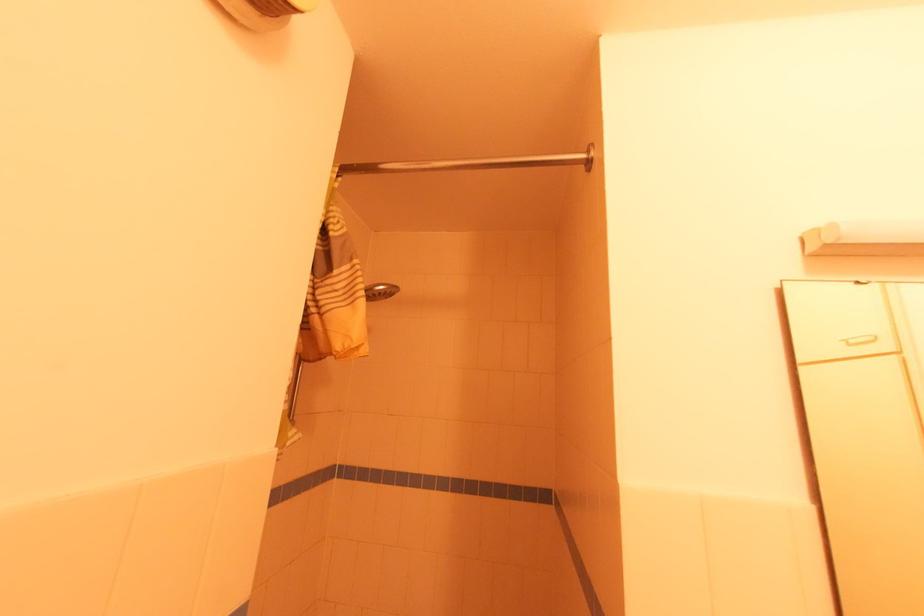
The image size is (924, 616). I want to click on cabinet door handle, so click(x=865, y=434).